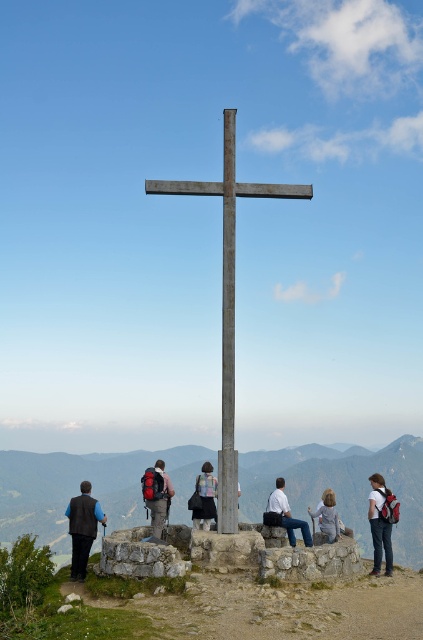
Does dark blue vest at lower left have a greater height compared to light blue jeans at center?

Yes, dark blue vest at lower left is taller than light blue jeans at center.

Does dark blue vest at lower left have a smaller size compared to light blue jeans at center?

No.

What do you see at coordinates (82, 529) in the screenshot?
I see `dark blue vest at lower left` at bounding box center [82, 529].

Locate an element on the screen. This screenshot has height=640, width=423. dark blue vest at lower left is located at coordinates (82, 529).

Is smooth stone cross at center further to the viewer compared to matte black backpack at lower right?

Yes.

Between smooth stone cross at center and matte black backpack at lower right, which one has less height?

With less height is matte black backpack at lower right.

The width and height of the screenshot is (423, 640). What do you see at coordinates (93, 490) in the screenshot?
I see `smooth stone cross at center` at bounding box center [93, 490].

The image size is (423, 640). In order to click on smooth stone cross at center in this screenshot , I will do `click(93, 490)`.

Between matte black backpack at lower right and matte black backpack at center, which one is positioned lower?

Positioned lower is matte black backpack at lower right.

Can you confirm if matte black backpack at lower right is wider than matte black backpack at center?

Yes, matte black backpack at lower right is wider than matte black backpack at center.

Is point (376, 532) in front of point (153, 486)?

Yes, point (376, 532) is closer to viewer.

Find the location of a particular element. matte black backpack at lower right is located at coordinates (381, 522).